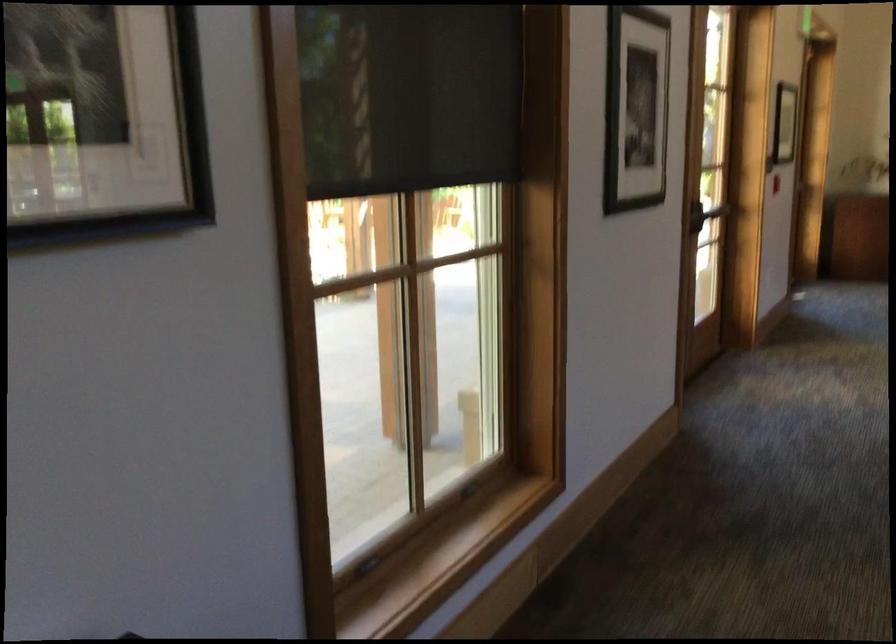
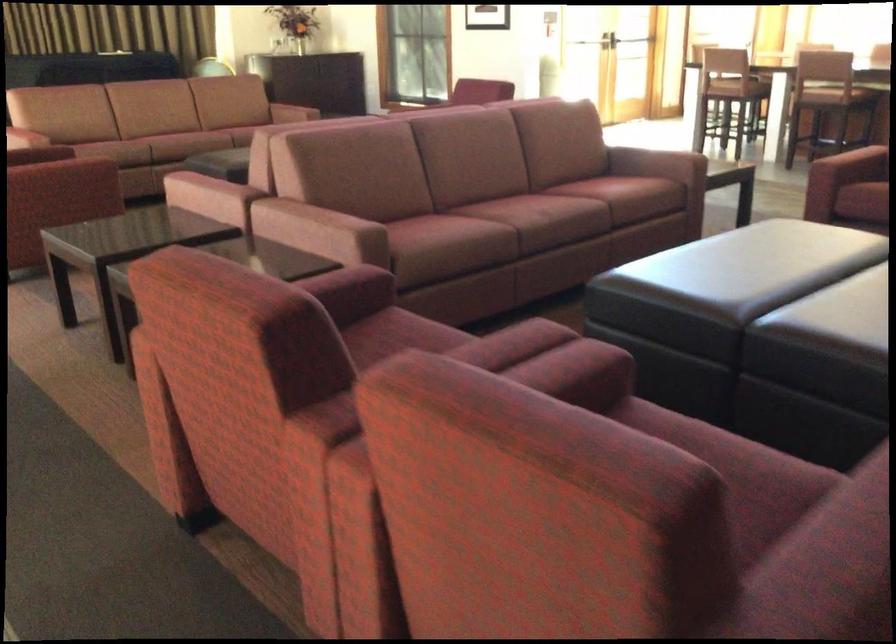
The first image is from the beginning of the video and the second image is from the end. How did the camera likely rotate when shooting the video?

The camera's rotation is toward right-down.